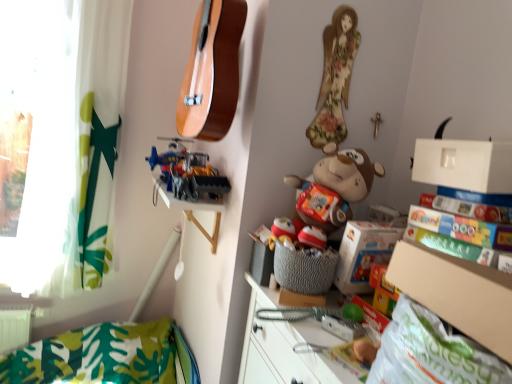
Question: From a real-world perspective, is brown plush monkey at center, the second toy from the back, on white matte box at upper right?

Choices:
 (A) yes
 (B) no

Answer: (B)

Question: Is brown plush monkey at center, the first toy positioned from the front, further to camera compared to white matte box at upper right?

Choices:
 (A) yes
 (B) no

Answer: (A)

Question: Can you confirm if brown plush monkey at center, the first toy positioned from the front, is shorter than white matte box at upper right?

Choices:
 (A) no
 (B) yes

Answer: (A)

Question: Does brown plush monkey at center, the 2th toy from the left, appear on the left side of white matte box at upper right?

Choices:
 (A) no
 (B) yes

Answer: (B)

Question: Considering the relative sizes of brown plush monkey at center, the first toy positioned from the front, and white matte box at upper right in the image provided, is brown plush monkey at center, the first toy positioned from the front, thinner than white matte box at upper right?

Choices:
 (A) no
 (B) yes

Answer: (A)

Question: From the image's perspective, is brown plush monkey at center, which ranks as the first toy in right-to-left order, above or below cardboard box at lower right?

Choices:
 (A) above
 (B) below

Answer: (A)

Question: Considering the positions of brown plush monkey at center, the first toy positioned from the front, and cardboard box at lower right in the image, is brown plush monkey at center, the first toy positioned from the front, wider or thinner than cardboard box at lower right?

Choices:
 (A) wide
 (B) thin

Answer: (B)

Question: Visually, is brown plush monkey at center, the first toy positioned from the front, positioned to the left or to the right of cardboard box at lower right?

Choices:
 (A) right
 (B) left

Answer: (B)

Question: Is point 289,180 positioned closer to the camera than point 502,350?

Choices:
 (A) farther
 (B) closer

Answer: (A)

Question: From the image's perspective, is transparent plastic window screen at upper left located above or below brown plush monkey at center, the first toy positioned from the front?

Choices:
 (A) above
 (B) below

Answer: (A)

Question: In terms of size, does transparent plastic window screen at upper left appear bigger or smaller than brown plush monkey at center, the second toy from the back?

Choices:
 (A) big
 (B) small

Answer: (A)

Question: From a real-world perspective, is transparent plastic window screen at upper left above or below brown plush monkey at center, the 2th toy from the left?

Choices:
 (A) below
 (B) above

Answer: (B)

Question: Would you say transparent plastic window screen at upper left is inside or outside brown plush monkey at center, the second toy from the back?

Choices:
 (A) outside
 (B) inside

Answer: (A)

Question: Considering their positions, is white matte box at upper right located in front of or behind natural wood guitar at upper center?

Choices:
 (A) behind
 (B) front

Answer: (B)

Question: Is white matte box at upper right inside the boundaries of natural wood guitar at upper center, or outside?

Choices:
 (A) inside
 (B) outside

Answer: (B)